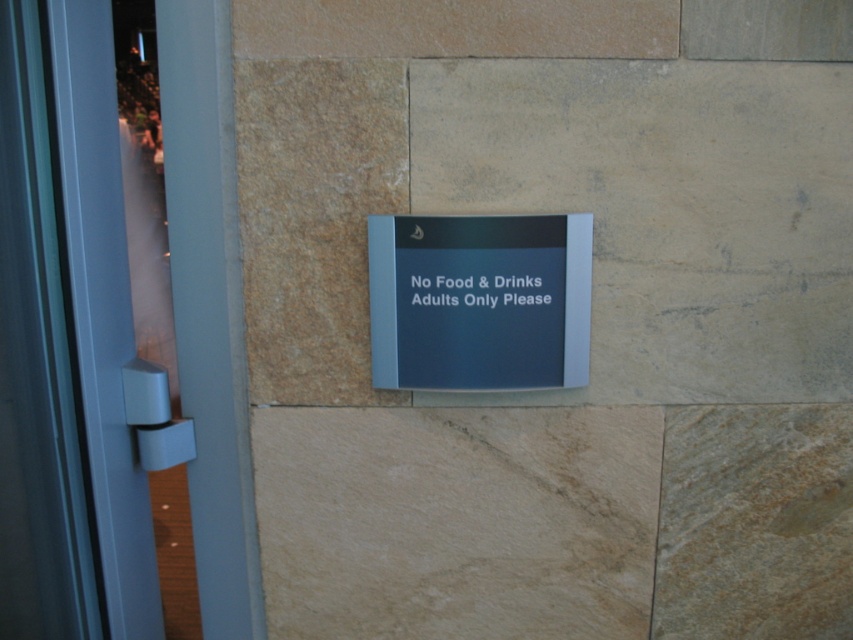
Question: Does transparent glass door at center appear under blue plastic sign at center?

Choices:
 (A) no
 (B) yes

Answer: (B)

Question: Does transparent glass door at center appear under black plastic sign at center?

Choices:
 (A) no
 (B) yes

Answer: (B)

Question: Which point is farther from the camera taking this photo?

Choices:
 (A) (444, 298)
 (B) (107, 620)
 (C) (415, 253)

Answer: (B)

Question: Is transparent glass door at center wider than blue plastic sign at center?

Choices:
 (A) yes
 (B) no

Answer: (A)

Question: Which point is farther to the camera?

Choices:
 (A) blue plastic sign at center
 (B) black plastic sign at center
 (C) transparent glass door at center

Answer: (B)

Question: Which point is closer to the camera?

Choices:
 (A) black plastic sign at center
 (B) transparent glass door at center
 (C) blue plastic sign at center

Answer: (B)